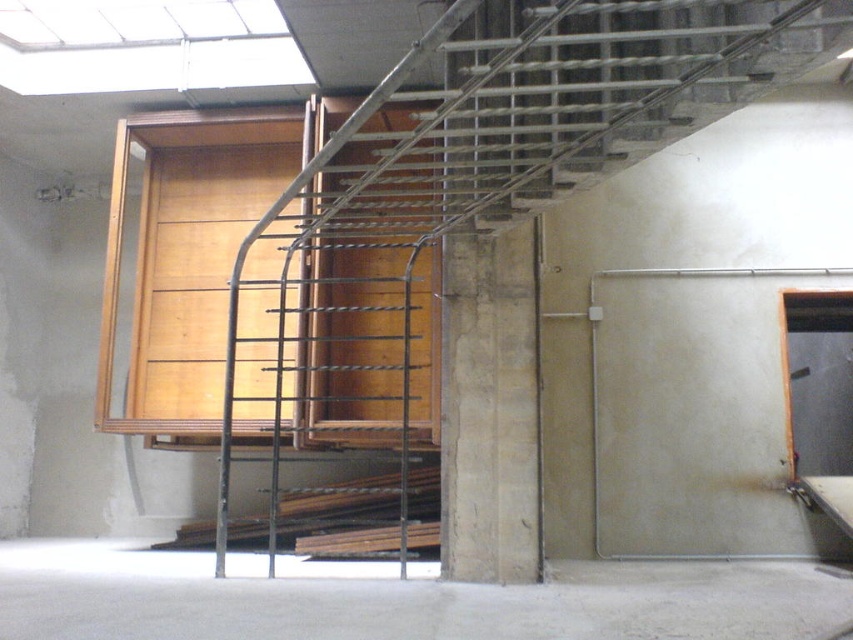
Question: Can you confirm if metallic gray ladder at center is positioned to the right of concrete floor at lower center?

Choices:
 (A) yes
 (B) no

Answer: (A)

Question: Which point is farther to the camera?

Choices:
 (A) (302, 312)
 (B) (695, 605)

Answer: (A)

Question: Is metallic gray ladder at center to the left of concrete floor at lower center from the viewer's perspective?

Choices:
 (A) no
 (B) yes

Answer: (A)

Question: Is metallic gray ladder at center thinner than concrete floor at lower center?

Choices:
 (A) no
 (B) yes

Answer: (B)